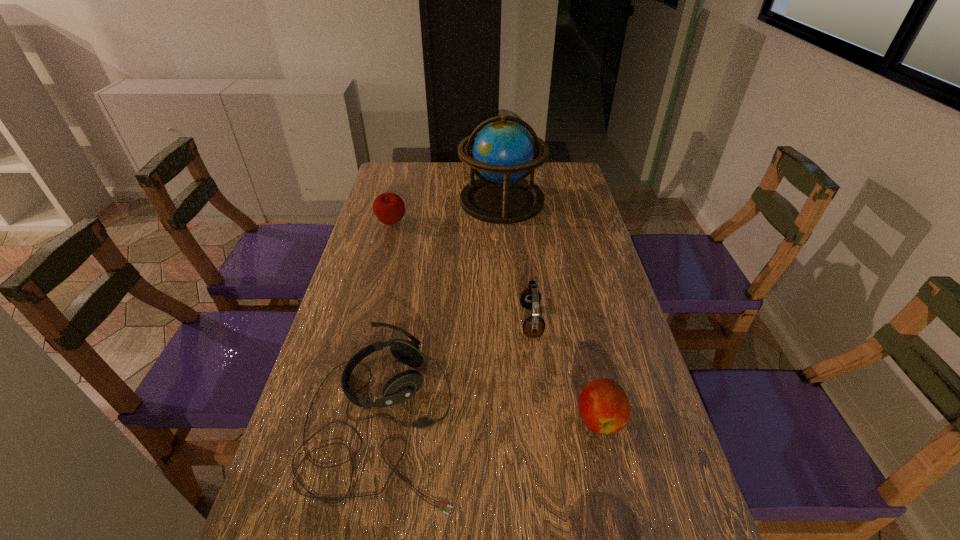
Find the location of a particular element. globe is located at coordinates pos(503,153).

Find the location of `the third nearest object`. the third nearest object is located at coordinates (533, 326).

This screenshot has width=960, height=540. I want to click on the farther headset, so click(533, 326).

This screenshot has height=540, width=960. What are the coordinates of `the farther apple` in the screenshot? It's located at (389, 208).

Locate an element on the screen. Image resolution: width=960 pixels, height=540 pixels. the nearer apple is located at coordinates (604, 407).

Locate an element on the screen. This screenshot has height=540, width=960. the left headset is located at coordinates click(x=402, y=386).

Identify the location of the shorter headset. The height and width of the screenshot is (540, 960). (402, 386).

Where is `vacant region located on the right of the tallest object`? The image size is (960, 540). vacant region located on the right of the tallest object is located at coordinates (570, 200).

Where is `vacant space located on the ear cups of the right headset`? This screenshot has width=960, height=540. vacant space located on the ear cups of the right headset is located at coordinates (417, 321).

Identify the location of free point located 0.190m on the ear cups of the right headset. tap(450, 321).